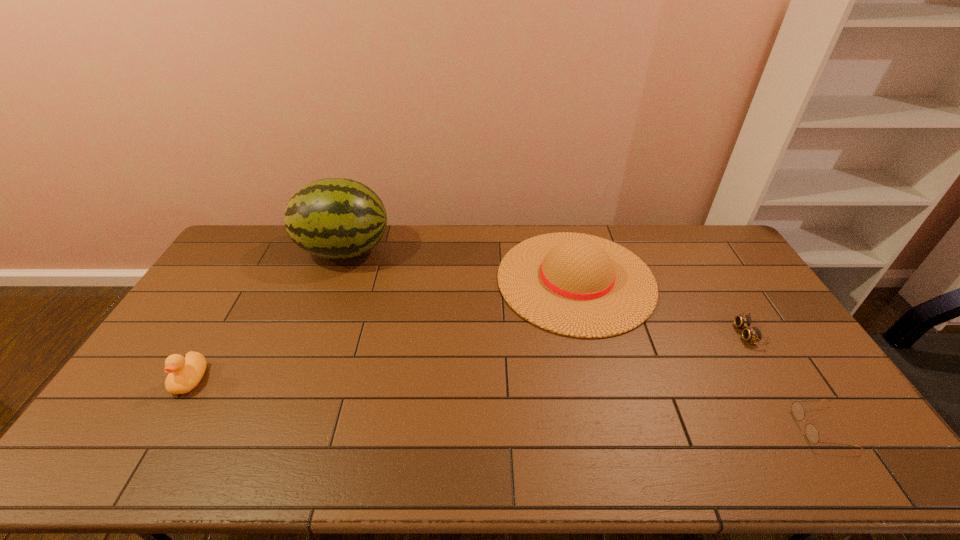
Identify which object is the fourth closest to the goggles. Please provide its 2D coordinates. Your answer should be formatted as a tuple, i.e. [(x, y)], where the tuple contains the x and y coordinates of a point satisfying the conditions above.

[(184, 375)]

Point out which object is positioned as the second nearest to the goggles. Please provide its 2D coordinates. Your answer should be formatted as a tuple, i.e. [(x, y)], where the tuple contains the x and y coordinates of a point satisfying the conditions above.

[(811, 432)]

You are a GUI agent. You are given a task and a screenshot of the screen. Output one action in this format:
    pyautogui.click(x=<x>, y=<y>)
    Task: Click on the free space that satisfies the following two spatial constraints: 1. at the stem end of the watermelon; 2. on the face of the second nearest object
    
    Given the screenshot: What is the action you would take?
    pyautogui.click(x=296, y=380)

You are a GUI agent. You are given a task and a screenshot of the screen. Output one action in this format:
    pyautogui.click(x=<x>, y=<y>)
    Task: Click on the vacant space that satisfies the following two spatial constraints: 1. at the stem end of the watermelon; 2. on the face of the duck
    This screenshot has height=540, width=960.
    Given the screenshot: What is the action you would take?
    pyautogui.click(x=296, y=380)

What are the coordinates of `free space in the image that satisfies the following two spatial constraints: 1. at the stem end of the fourth object from right to left; 2. on the right side of the bonnet` in the screenshot? It's located at (333, 280).

This screenshot has height=540, width=960. What are the coordinates of `vacant area in the image that satisfies the following two spatial constraints: 1. at the stem end of the watermelon; 2. on the face of the fourth farthest object` in the screenshot? It's located at (296, 380).